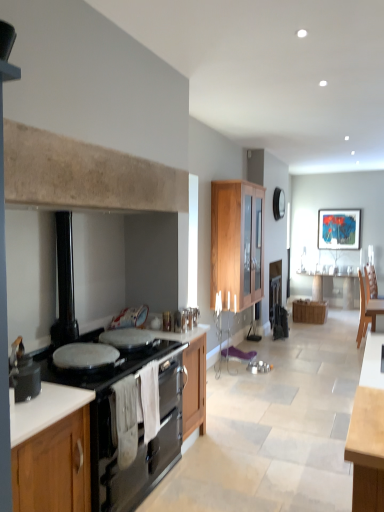
I want to click on empty space that is ontop of white glossy countertop at lower left, placed as the 1th countertop when sorted from front to back (from a real-world perspective), so click(x=40, y=407).